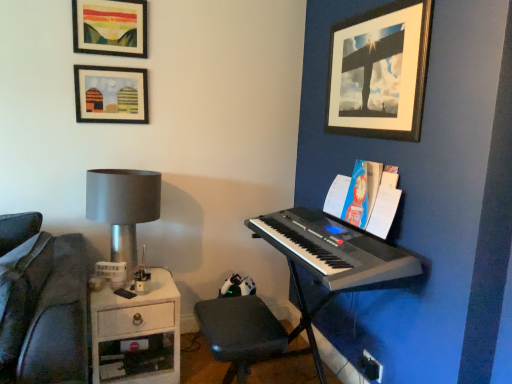
Question: Can you confirm if matte silver lamp at left is bigger than silver metallic keyboard at right?

Choices:
 (A) yes
 (B) no

Answer: (B)

Question: Does matte silver lamp at left have a greater width compared to silver metallic keyboard at right?

Choices:
 (A) yes
 (B) no

Answer: (B)

Question: Is matte silver lamp at left facing towards silver metallic keyboard at right?

Choices:
 (A) no
 (B) yes

Answer: (A)

Question: Can you confirm if matte silver lamp at left is thinner than silver metallic keyboard at right?

Choices:
 (A) no
 (B) yes

Answer: (B)

Question: Is matte silver lamp at left to the left of silver metallic keyboard at right from the viewer's perspective?

Choices:
 (A) yes
 (B) no

Answer: (A)

Question: From a real-world perspective, relative to matte silver lamp at left, is black plastic keyboard at right vertically above or below?

Choices:
 (A) above
 (B) below

Answer: (A)

Question: Is point (358, 246) positioned closer to the camera than point (112, 183)?

Choices:
 (A) closer
 (B) farther

Answer: (A)

Question: In the image, is black plastic keyboard at right positioned in front of or behind matte silver lamp at left?

Choices:
 (A) front
 (B) behind

Answer: (A)

Question: From their relative heights in the image, would you say black plastic keyboard at right is taller or shorter than matte silver lamp at left?

Choices:
 (A) tall
 (B) short

Answer: (B)

Question: From a real-world perspective, is matte silver lamp at left physically located above or below wooden picture frame at upper right, which is counted as the 1th picture frame, starting from the right?

Choices:
 (A) below
 (B) above

Answer: (A)

Question: Would you say matte silver lamp at left is to the left or to the right of wooden picture frame at upper right, which is counted as the 1th picture frame, starting from the right, in the picture?

Choices:
 (A) right
 (B) left

Answer: (B)

Question: Looking at their shapes, would you say matte silver lamp at left is wider or thinner than wooden picture frame at upper right, which is the third picture frame in left-to-right order?

Choices:
 (A) thin
 (B) wide

Answer: (B)

Question: Is point (139, 210) closer or farther from the camera than point (415, 74)?

Choices:
 (A) farther
 (B) closer

Answer: (A)

Question: Is point (90, 31) positioned closer to the camera than point (311, 216)?

Choices:
 (A) closer
 (B) farther

Answer: (A)

Question: Considering the positions of matte glass picture frame at upper left, placed as the second picture frame when sorted from right to left, and silver metallic keyboard at right in the image, is matte glass picture frame at upper left, placed as the second picture frame when sorted from right to left, bigger or smaller than silver metallic keyboard at right?

Choices:
 (A) big
 (B) small

Answer: (B)